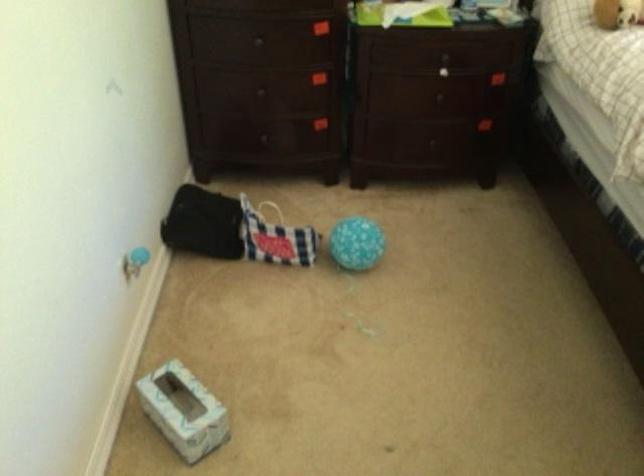
Find where to lift the patterned tissue box. Please return your answer as a coordinate pair (x, y).

(183, 410)